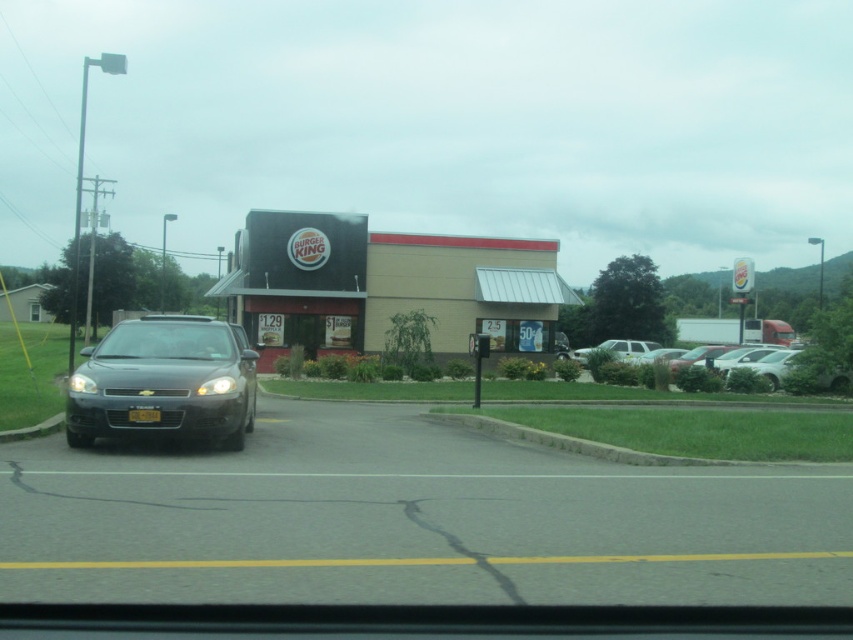
Who is positioned more to the left, matte black headlight at lower left or yellow matte license plate at center?

yellow matte license plate at center is more to the left.

Who is higher up, matte black headlight at lower left or yellow matte license plate at center?

Positioned higher is matte black headlight at lower left.

Does point (227, 381) come closer to viewer compared to point (149, 420)?

No, (227, 381) is further to viewer.

The image size is (853, 640). I want to click on matte black headlight at lower left, so click(x=216, y=385).

Does matte black headlight at lower left have a smaller size compared to matte black headlight at left?

Incorrect, matte black headlight at lower left is not smaller in size than matte black headlight at left.

Does matte black headlight at lower left appear under matte black headlight at left?

Indeed, matte black headlight at lower left is positioned under matte black headlight at left.

In the scene shown: Measure the distance between point (215, 381) and camera.

Point (215, 381) and camera are 12.14 meters apart from each other.

Where is `matte black headlight at lower left`? This screenshot has height=640, width=853. matte black headlight at lower left is located at coordinates (216, 385).

Locate an element on the screen. Image resolution: width=853 pixels, height=640 pixels. beige concrete burger king at center is located at coordinates (387, 284).

Can you confirm if beige concrete burger king at center is positioned to the right of matte black headlight at left?

Yes, beige concrete burger king at center is to the right of matte black headlight at left.

The height and width of the screenshot is (640, 853). I want to click on beige concrete burger king at center, so click(387, 284).

Where is `beige concrete burger king at center`? This screenshot has width=853, height=640. beige concrete burger king at center is located at coordinates (387, 284).